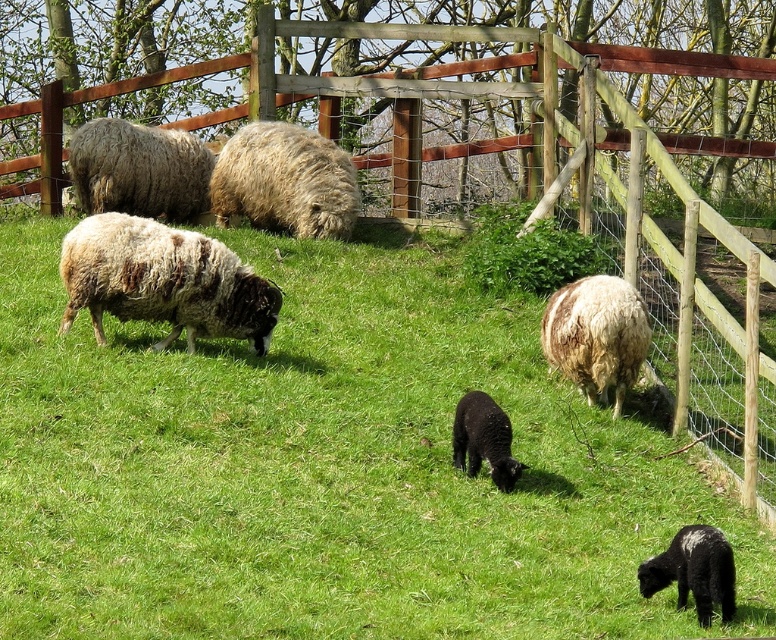
Consider the image. Can you confirm if fluffy woolen sheep at upper left is positioned below brown woolen sheep at center?

Actually, fluffy woolen sheep at upper left is above brown woolen sheep at center.

Can you confirm if fluffy woolen sheep at upper left is positioned above brown woolen sheep at center?

Yes.

Locate an element on the screen. fluffy woolen sheep at upper left is located at coordinates (139, 170).

In order to click on fluffy woolen sheep at upper left in this screenshot , I will do `click(139, 170)`.

Which is more to the left, black woolly lamb at lower right or black woolly lamb at center?

From the viewer's perspective, black woolly lamb at center appears more on the left side.

Between black woolly lamb at lower right and black woolly lamb at center, which one is positioned lower?

black woolly lamb at lower right is lower down.

Is point (679, 556) closer to camera compared to point (501, 467)?

Yes, point (679, 556) is closer to viewer.

Where is `black woolly lamb at lower right`? black woolly lamb at lower right is located at coordinates (695, 572).

Does brown woolen sheep at center have a greater width compared to black woolly lamb at center?

Indeed, brown woolen sheep at center has a greater width compared to black woolly lamb at center.

Is point (619, 381) farther from viewer compared to point (462, 426)?

Yes, it is behind point (462, 426).

Measure the distance between brown woolen sheep at center and camera.

8.07 meters

Locate an element on the screen. The image size is (776, 640). brown woolen sheep at center is located at coordinates (596, 336).